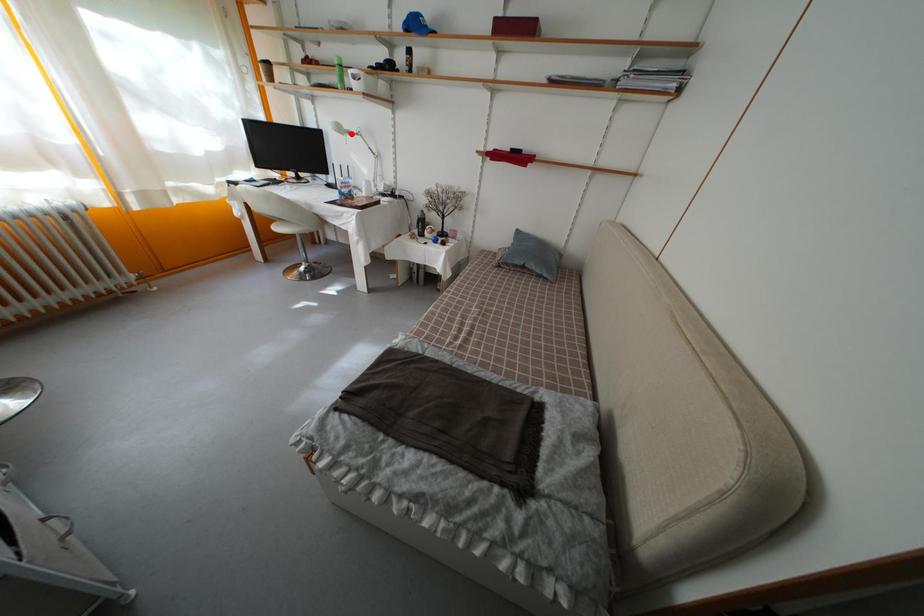
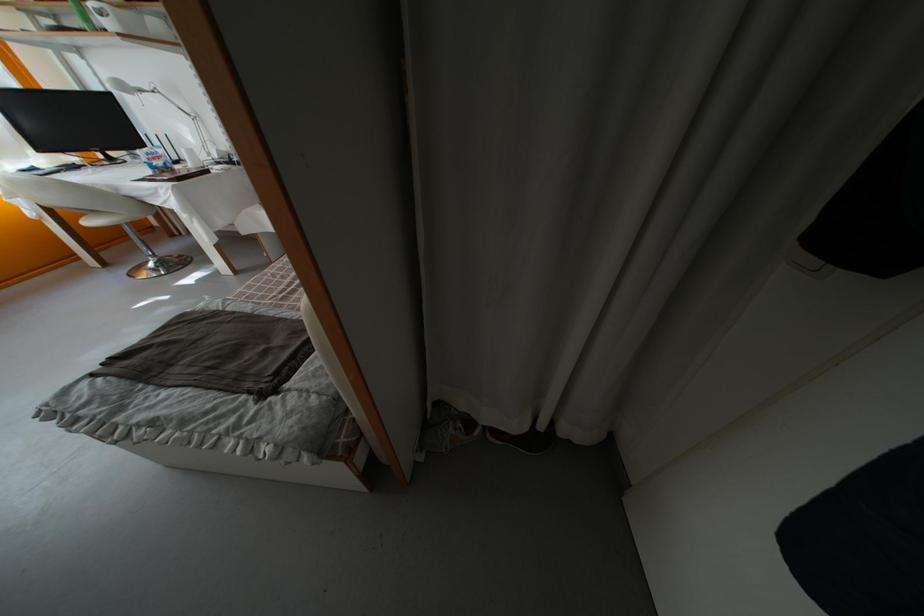
In the second image, find the point that corresponds to the highlighted location in the first image.

(139, 91)